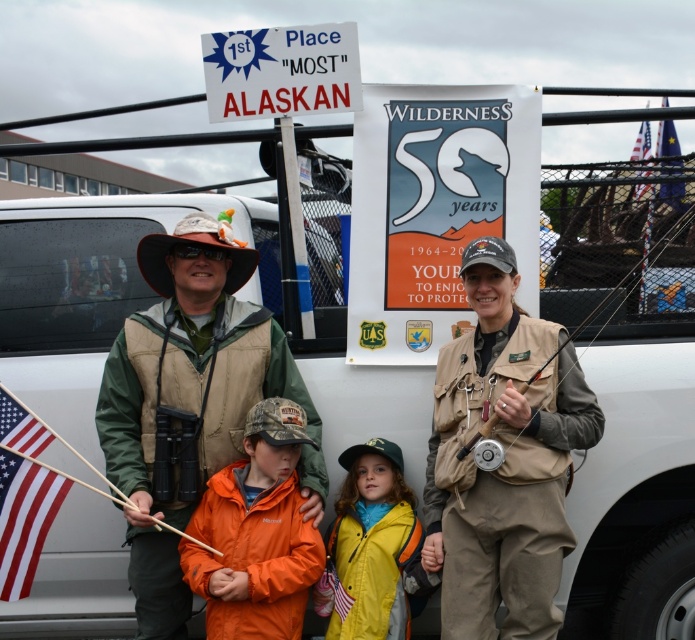
Does white matte van at center have a greater width compared to tan fabric vest at center?

Yes.

Where is `white matte van at center`? white matte van at center is located at coordinates (637, 483).

Is point (613, 541) positioned after point (496, 260)?

Yes.

This screenshot has width=695, height=640. What are the coordinates of `white matte van at center` in the screenshot? It's located at (637, 483).

Is camouflage fabric cowboy hat at center bigger than blue fabric flag at upper right?

Indeed, camouflage fabric cowboy hat at center has a larger size compared to blue fabric flag at upper right.

Which is in front, point (229, 253) or point (671, 132)?

Point (229, 253)

This screenshot has height=640, width=695. What are the coordinates of `camouflage fabric cowboy hat at center` in the screenshot? It's located at (193, 244).

Between point (304, 596) and point (15, 506), which one is positioned in front?

Point (304, 596) is in front.

Who is more distant from viewer, (x=281, y=554) or (x=13, y=435)?

Positioned behind is point (x=13, y=435).

What do you see at coordinates (254, 532) in the screenshot?
I see `orange softshell jacket at center` at bounding box center [254, 532].

Locate an element on the screen. orange softshell jacket at center is located at coordinates (254, 532).